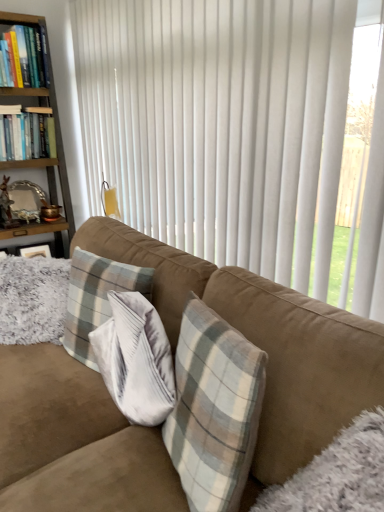
This screenshot has width=384, height=512. What do you see at coordinates (30, 55) in the screenshot?
I see `hardcover book at upper left, which is the 2th book from bottom to top` at bounding box center [30, 55].

The image size is (384, 512). What do you see at coordinates (96, 298) in the screenshot?
I see `plaid fabric pillow at center` at bounding box center [96, 298].

The height and width of the screenshot is (512, 384). I want to click on wooden bookshelf at left, so [56, 141].

Between hardcover books at left, which appears as the first book when ordered from the bottom, and hardcover book at upper left, the 1th book when ordered from top to bottom, which one appears on the right side from the viewer's perspective?

Positioned to the right is hardcover book at upper left, the 1th book when ordered from top to bottom.

Between hardcover books at left, the second book when ordered from top to bottom, and hardcover book at upper left, the 1th book when ordered from top to bottom, which one has larger width?

With larger width is hardcover books at left, the second book when ordered from top to bottom.

Between hardcover books at left, the second book when ordered from top to bottom, and hardcover book at upper left, the 1th book when ordered from top to bottom, which one has more height?

hardcover book at upper left, the 1th book when ordered from top to bottom.

Is hardcover books at left, the second book when ordered from top to bottom, next to wooden bookshelf at left?

hardcover books at left, the second book when ordered from top to bottom, and wooden bookshelf at left are not in contact.

Which is nearer, (x=8, y=151) or (x=48, y=52)?

The point (x=8, y=151) is more forward.

Does hardcover books at left, which appears as the first book when ordered from the bottom, turn towards wooden bookshelf at left?

Yes, hardcover books at left, which appears as the first book when ordered from the bottom, is turned towards wooden bookshelf at left.

Is hardcover books at left, which appears as the first book when ordered from the bottom, taller than wooden bookshelf at left?

No, hardcover books at left, which appears as the first book when ordered from the bottom, is not taller than wooden bookshelf at left.

How much distance is there between white vertical blinds at center and hardcover books at left, the second book when ordered from top to bottom?

white vertical blinds at center is 3.34 feet from hardcover books at left, the second book when ordered from top to bottom.

Is white vertical blinds at center bigger than hardcover books at left, which appears as the first book when ordered from the bottom?

Correct, white vertical blinds at center is larger in size than hardcover books at left, which appears as the first book when ordered from the bottom.

From a real-world perspective, which is physically below, white vertical blinds at center or hardcover books at left, the second book when ordered from top to bottom?

From a 3D spatial view, hardcover books at left, the second book when ordered from top to bottom, is below.

Considering the positions of objects white vertical blinds at center and hardcover books at left, the second book when ordered from top to bottom, in the image provided, who is in front, white vertical blinds at center or hardcover books at left, the second book when ordered from top to bottom,?

white vertical blinds at center.

Which is in front, white vertical blinds at center or plaid fabric pillow at center?

white vertical blinds at center is more forward.

Considering the relative positions of white vertical blinds at center and plaid fabric pillow at center in the image provided, is white vertical blinds at center to the left of plaid fabric pillow at center from the viewer's perspective?

In fact, white vertical blinds at center is to the right of plaid fabric pillow at center.

Find the location of `pillow on the left of white vertical blinds at center`. pillow on the left of white vertical blinds at center is located at coordinates (96, 298).

Considering the sizes of objects white vertical blinds at center and plaid fabric pillow at center in the image provided, who is shorter, white vertical blinds at center or plaid fabric pillow at center?

plaid fabric pillow at center.

From the image's perspective, is suede couch at center above white vertical blinds at center?

No, from the image's perspective, suede couch at center is not over white vertical blinds at center.

Are suede couch at center and white vertical blinds at center beside each other?

No, suede couch at center is not with white vertical blinds at center.

Who is taller, suede couch at center or white vertical blinds at center?

With more height is white vertical blinds at center.

Identify the location of studio couch lying below the white vertical blinds at center (from the image's perspective). This screenshot has height=512, width=384. (266, 345).

Could plaid fabric pillow at center be considered to be inside hardcover books at left, which appears as the first book when ordered from the bottom?

That's incorrect, plaid fabric pillow at center is not inside hardcover books at left, which appears as the first book when ordered from the bottom.

From the picture: Is hardcover books at left, the second book when ordered from top to bottom, aimed at plaid fabric pillow at center?

No.

From a real-world perspective, is hardcover books at left, which appears as the first book when ordered from the bottom, positioned under plaid fabric pillow at center based on gravity?

Incorrect, from a real-world perspective, hardcover books at left, which appears as the first book when ordered from the bottom, is higher than plaid fabric pillow at center.

Does hardcover books at left, the second book when ordered from top to bottom, appear on the right side of plaid fabric pillow at center?

No.

Considering the sizes of objects wooden bookshelf at left and hardcover books at left, the second book when ordered from top to bottom, in the image provided, who is wider, wooden bookshelf at left or hardcover books at left, the second book when ordered from top to bottom,?

With larger width is wooden bookshelf at left.

Considering the sizes of objects wooden bookshelf at left and hardcover books at left, the second book when ordered from top to bottom, in the image provided, who is taller, wooden bookshelf at left or hardcover books at left, the second book when ordered from top to bottom,?

wooden bookshelf at left.

Would you say wooden bookshelf at left is a long distance from hardcover books at left, which appears as the first book when ordered from the bottom?

wooden bookshelf at left is actually quite close to hardcover books at left, which appears as the first book when ordered from the bottom.

You are a GUI agent. You are given a task and a screenshot of the screen. Output one action in this format:
    pyautogui.click(x=<x>, y=<y>)
    Task: Click on the book above the hardcover books at left, the second book when ordered from top to bottom (from a real-world perspective)
    The image size is (384, 512).
    Given the screenshot: What is the action you would take?
    pyautogui.click(x=30, y=55)

This screenshot has width=384, height=512. In order to click on bookcase below the hardcover books at left, which appears as the first book when ordered from the bottom (from a real-world perspective) in this screenshot , I will do pos(56,141).

Considering their positions, is white vertical blinds at center positioned further to wooden bookshelf at left than hardcover books at left, which appears as the first book when ordered from the bottom?

white vertical blinds at center lies further to wooden bookshelf at left than the other object.

From the image, which object appears to be nearer to hardcover book at upper left, the 1th book when ordered from top to bottom, hardcover books at left, which appears as the first book when ordered from the bottom, or suede couch at center?

hardcover books at left, which appears as the first book when ordered from the bottom, lies closer to hardcover book at upper left, the 1th book when ordered from top to bottom, than the other object.

From the image, which object appears to be nearer to hardcover books at left, the second book when ordered from top to bottom, wooden bookshelf at left or suede couch at center?

wooden bookshelf at left is closer to hardcover books at left, the second book when ordered from top to bottom.

Based on their spatial positions, is suede couch at center or plaid fabric pillow at center closer to white vertical blinds at center?

Among the two, suede couch at center is located nearer to white vertical blinds at center.

From the image, which object appears to be nearer to suede couch at center, hardcover books at left, which appears as the first book when ordered from the bottom, or wooden bookshelf at left?

hardcover books at left, which appears as the first book when ordered from the bottom, is closer to suede couch at center.

Considering their positions, is white vertical blinds at center positioned closer to hardcover book at upper left, which is the 2th book from bottom to top, than plaid fabric pillow at center?

The object closer to hardcover book at upper left, which is the 2th book from bottom to top, is white vertical blinds at center.

From the image, which object appears to be farther from white vertical blinds at center, hardcover books at left, which appears as the first book when ordered from the bottom, or suede couch at center?

Among the two, hardcover books at left, which appears as the first book when ordered from the bottom, is located further to white vertical blinds at center.

When comparing their distances from hardcover book at upper left, the 1th book when ordered from top to bottom, does suede couch at center or white vertical blinds at center seem closer?

The object closer to hardcover book at upper left, the 1th book when ordered from top to bottom, is white vertical blinds at center.

The image size is (384, 512). In order to click on pillow between white vertical blinds at center and wooden bookshelf at left along the z-axis in this screenshot , I will do `click(96, 298)`.

At what (x,y) coordinates should I click in order to perform the action: click on pillow between suede couch at center and wooden bookshelf at left along the z-axis. Please return your answer as a coordinate pair (x, y). Looking at the image, I should click on (96, 298).

Find the location of a particular element. This screenshot has height=512, width=384. pillow between white vertical blinds at center and suede couch at center from top to bottom is located at coordinates (96, 298).

The height and width of the screenshot is (512, 384). I want to click on book between white vertical blinds at center and hardcover books at left, which appears as the first book when ordered from the bottom, from front to back, so click(30, 55).